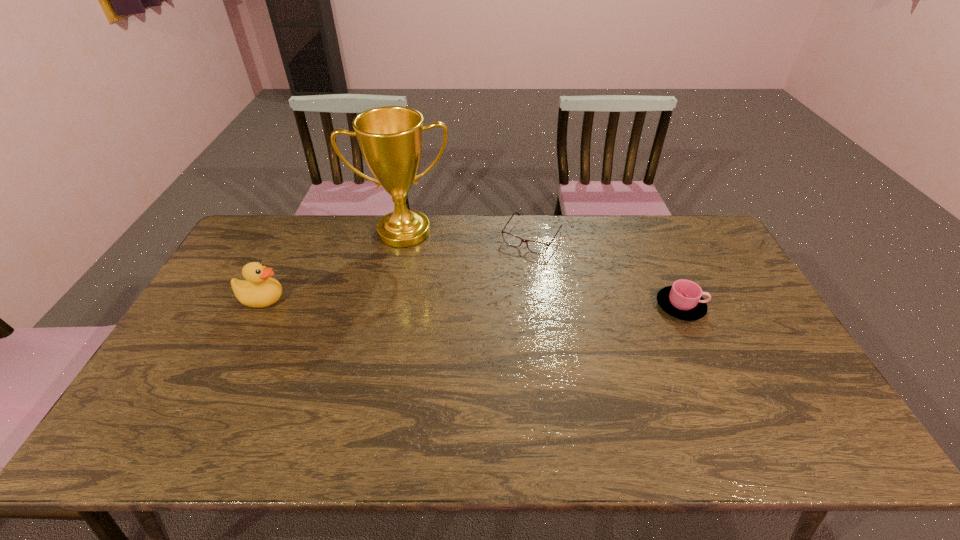
Find the location of a particular element. The height and width of the screenshot is (540, 960). vacant space at the far edge is located at coordinates (661, 225).

This screenshot has height=540, width=960. What are the coordinates of `vacant space at the near edge` in the screenshot? It's located at (665, 387).

Where is `vacant region at the left edge of the desktop`? The image size is (960, 540). vacant region at the left edge of the desktop is located at coordinates (226, 295).

Identify the location of free region at the far left corner of the desktop. (261, 215).

In the image, there is a desktop. Identify the location of vacant area at the far right corner. (683, 256).

You are a GUI agent. You are given a task and a screenshot of the screen. Output one action in this format:
    pyautogui.click(x=<x>, y=<y>)
    Task: Click on the unoccupied position between the duck and the award
    This screenshot has height=540, width=960.
    Given the screenshot: What is the action you would take?
    pyautogui.click(x=333, y=266)

Where is `vacant area that lies between the award and the second tallest object`? The width and height of the screenshot is (960, 540). vacant area that lies between the award and the second tallest object is located at coordinates (333, 266).

This screenshot has width=960, height=540. What are the coordinates of `vacant space that's between the third object from right to left and the duck` in the screenshot? It's located at (333, 266).

You are a GUI agent. You are given a task and a screenshot of the screen. Output one action in this format:
    pyautogui.click(x=<x>, y=<y>)
    Task: Click on the free space between the third shortest object and the third object from right to left
    The image size is (960, 540).
    Given the screenshot: What is the action you would take?
    333,266

Find the location of a particular element. free spot between the cup and the tallest object is located at coordinates (542, 269).